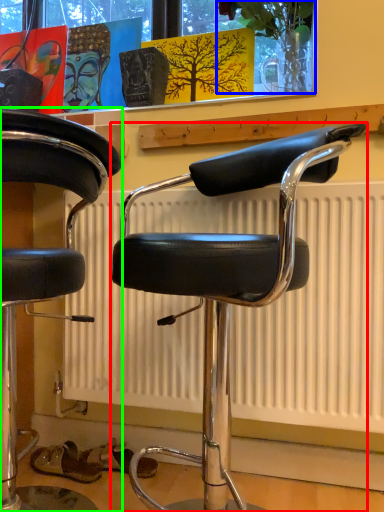
Question: Which is farther away from chair (highlighted by a red box)? plant (highlighted by a blue box) or chair (highlighted by a green box)?

Choices:
 (A) plant
 (B) chair

Answer: (A)